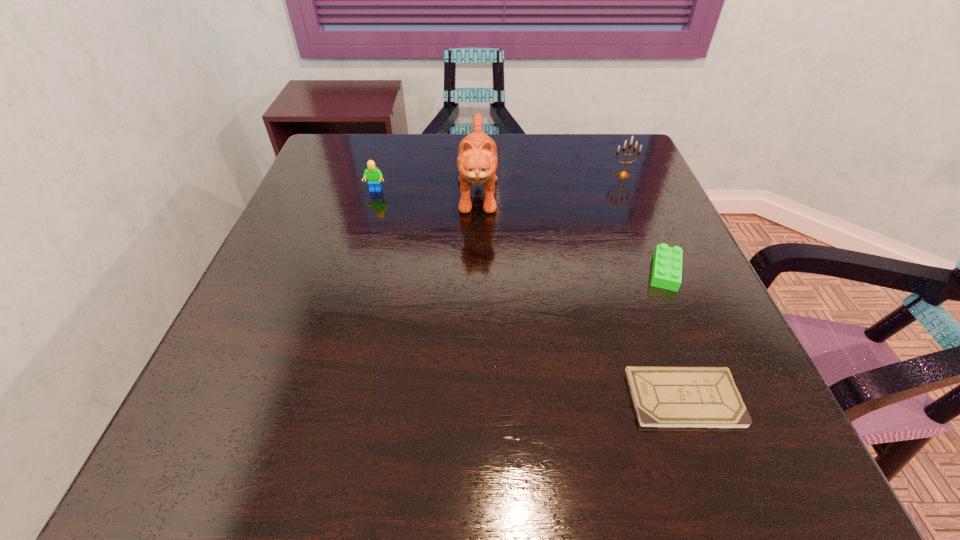
Image resolution: width=960 pixels, height=540 pixels. Identify the location of vacant region at the far edge of the desktop. (404, 148).

In the image, there is a desktop. Identify the location of vacant space at the near edge. (506, 494).

You are a GUI agent. You are given a task and a screenshot of the screen. Output one action in this format:
    pyautogui.click(x=<x>, y=<y>)
    Task: Click on the vacant point at the left edge
    The width and height of the screenshot is (960, 540).
    Given the screenshot: What is the action you would take?
    pos(320,214)

I want to click on free space at the right edge of the desktop, so click(690, 312).

Where is `free point at the far left corner`? The image size is (960, 540). free point at the far left corner is located at coordinates (367, 150).

You are a GUI agent. You are given a task and a screenshot of the screen. Output one action in this format:
    pyautogui.click(x=<x>, y=<y>)
    Task: Click on the free space at the near left corner of the desktop
    This screenshot has height=540, width=960.
    Given the screenshot: What is the action you would take?
    pyautogui.click(x=248, y=462)

In the image, there is a desktop. Where is `vacant space at the near right corner`? vacant space at the near right corner is located at coordinates (764, 437).

The image size is (960, 540). I want to click on free spot between the leftmost object and the second tallest object, so click(x=499, y=183).

Find the location of a particular element. This screenshot has height=540, width=960. vacant area between the left Lego and the fourth shortest object is located at coordinates (499, 183).

The height and width of the screenshot is (540, 960). I want to click on vacant space that's between the nearer Lego and the nearest object, so click(x=675, y=335).